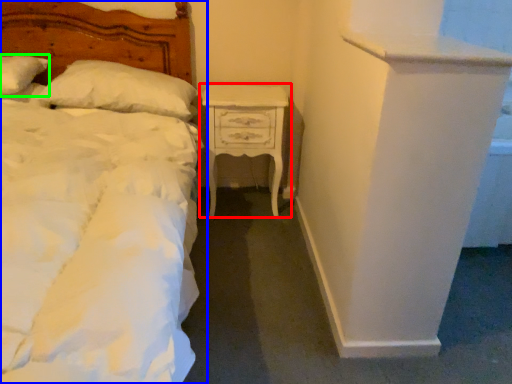
Question: Which is farther away from nightstand (highlighted by a red box)? bed (highlighted by a blue box) or pillow (highlighted by a green box)?

Choices:
 (A) bed
 (B) pillow

Answer: (B)